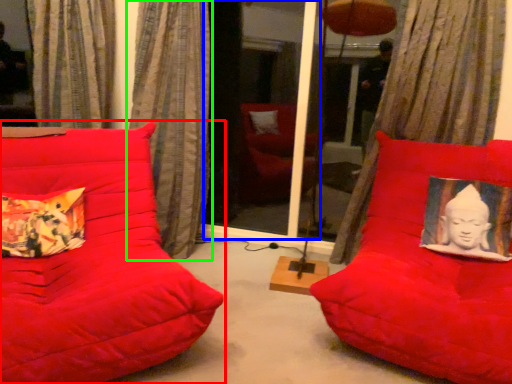
Question: Which object is positioned farthest from furniture (highlighted by a red box)? Select from screen door (highlighted by a blue box) and curtain (highlighted by a green box).

Choices:
 (A) screen door
 (B) curtain

Answer: (A)